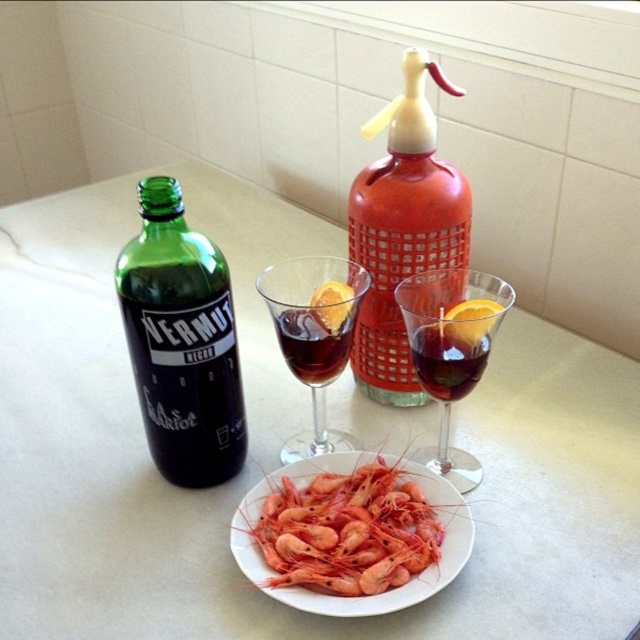
You are a bartender preparing a drink. You have a point marked at coordinates (x=314, y=336). What object is this point located on?

The point at coordinates (x=314, y=336) is located on the transparent glass wine glass at center.

Looking at this image, you are a bartender preparing a drink. You have a translucent glass wine glass at center and a dark red glass at center on the counter. You need to place a lemon slice between them. Is there enough space to fit the lemon slice between the two glasses?

The distance between the translucent glass wine glass at center and the dark red glass at center is 1.29 inches. A standard lemon slice is typically around 0.5 to 0.75 inches in diameter. Since the space between the glasses is wider than the lemon slice, there is enough space to place the lemon slice between them.

You are a bartender preparing drinks and need to reach for the transparent glass wine glass at center. Considering your arm can comfortably reach 22 inches, will you be able to reach it without moving your body?

The transparent glass wine glass at center is 22.57 inches away from camera. Since your arm can reach 22 inches, you cannot reach it without moving your body.